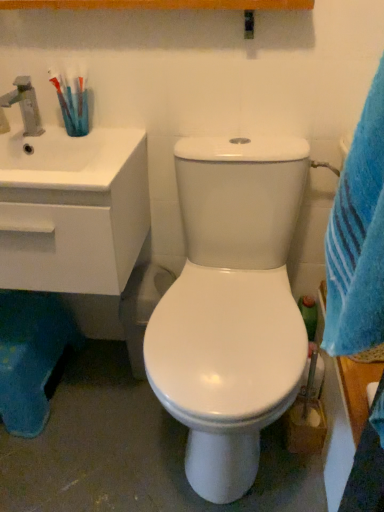
Describe the element at coordinates (30, 356) in the screenshot. I see `blue plush rug at lower left` at that location.

This screenshot has height=512, width=384. Describe the element at coordinates (25, 105) in the screenshot. I see `matte silver faucet at upper left` at that location.

This screenshot has width=384, height=512. What are the coordinates of `blue plush rug at lower left` in the screenshot? It's located at (30, 356).

Which of these two, translucent plastic toothbrush at upper left or blue plush rug at lower left, stands shorter?

translucent plastic toothbrush at upper left is shorter.

From a real-world perspective, is translucent plastic toothbrush at upper left physically located above or below blue plush rug at lower left?

In terms of real-world spatial position, translucent plastic toothbrush at upper left is above blue plush rug at lower left.

Measure the distance between translucent plastic toothbrush at upper left and blue plush rug at lower left.

translucent plastic toothbrush at upper left is 27.72 inches from blue plush rug at lower left.

Looking at this image, is translucent plastic toothbrush at upper left outside of blue plush rug at lower left?

Indeed, translucent plastic toothbrush at upper left is completely outside blue plush rug at lower left.

From a real-world perspective, who is located lower, blue plush rug at lower left or matte silver faucet at upper left?

In real-world perspective, blue plush rug at lower left is lower.

Consider the image. Which object is thinner, blue plush rug at lower left or matte silver faucet at upper left?

matte silver faucet at upper left.

Can you confirm if blue plush rug at lower left is shorter than matte silver faucet at upper left?

In fact, blue plush rug at lower left may be taller than matte silver faucet at upper left.

Is blue plush rug at lower left spatially inside matte silver faucet at upper left, or outside of it?

The correct answer is: outside.

Would you say matte silver faucet at upper left is outside blue plush rug at lower left?

Indeed, matte silver faucet at upper left is completely outside blue plush rug at lower left.

Is matte silver faucet at upper left positioned far away from blue plush rug at lower left?

No, matte silver faucet at upper left is in close proximity to blue plush rug at lower left.

Locate an element on the screen. tap located in front of the blue plush rug at lower left is located at coordinates (25, 105).

Between point (37, 110) and point (64, 321), which one is positioned in front?

Point (37, 110)

Is blue plush rug at lower left shorter than translucent plastic toothbrush at upper left?

No, blue plush rug at lower left is not shorter than translucent plastic toothbrush at upper left.

In terms of width, does blue plush rug at lower left look wider or thinner when compared to translucent plastic toothbrush at upper left?

blue plush rug at lower left is wider than translucent plastic toothbrush at upper left.

Is blue plush rug at lower left to the left or to the right of translucent plastic toothbrush at upper left in the image?

blue plush rug at lower left is to the left of translucent plastic toothbrush at upper left.

Is translucent plastic toothbrush at upper left completely or partially inside blue plush rug at lower left?

No, translucent plastic toothbrush at upper left is not a part of blue plush rug at lower left.

Who is bigger, white glossy sink at left or translucent plastic toothbrush at upper left?

white glossy sink at left is bigger.

Which object is positioned more to the right, white glossy sink at left or translucent plastic toothbrush at upper left?

translucent plastic toothbrush at upper left.

Is translucent plastic toothbrush at upper left at the back of white glossy sink at left?

No, white glossy sink at left is not facing the opposite direction of translucent plastic toothbrush at upper left.

Is point (4, 191) closer or farther from the camera than point (78, 116)?

Point (4, 191).

From the image's perspective, relative to white glossy sink at left, is translucent plastic toothbrush at upper left above or below?

Based on their image positions, translucent plastic toothbrush at upper left is located above white glossy sink at left.

Locate an element on the screen. This screenshot has height=512, width=384. counter top below the translucent plastic toothbrush at upper left (from a real-world perspective) is located at coordinates (73, 210).

Can you confirm if translucent plastic toothbrush at upper left is taller than white glossy sink at left?

No, translucent plastic toothbrush at upper left is not taller than white glossy sink at left.

Looking at this image, is translucent plastic toothbrush at upper left oriented away from white glossy sink at left?

That's not correct — translucent plastic toothbrush at upper left is not looking away from white glossy sink at left.

Which is behind, point (81, 130) or point (34, 94)?

The point (34, 94) is more distant.

Is translucent plastic toothbrush at upper left facing towards matte silver faucet at upper left?

No, translucent plastic toothbrush at upper left is not turned towards matte silver faucet at upper left.

Can you confirm if translucent plastic toothbrush at upper left is wider than matte silver faucet at upper left?

No.

Between translucent plastic toothbrush at upper left and matte silver faucet at upper left, which one has less height?

matte silver faucet at upper left is shorter.

You are a GUI agent. You are given a task and a screenshot of the screen. Output one action in this format:
    pyautogui.click(x=<x>, y=<y>)
    Task: Click on the toothbrush to the right of blue plush rug at lower left
    The image size is (384, 512).
    Given the screenshot: What is the action you would take?
    pyautogui.click(x=72, y=100)

There is a blue plush rug at lower left. At what (x,y) coordinates should I click in order to perform the action: click on tap above it (from a real-world perspective). Please return your answer as a coordinate pair (x, y). The image size is (384, 512). Looking at the image, I should click on (25, 105).

Considering their positions, is translucent plastic toothbrush at upper left positioned further to matte silver faucet at upper left than white glossy sink at left?

white glossy sink at left lies further to matte silver faucet at upper left than the other object.

From the image, which object appears to be nearer to white glossy sink at left, translucent plastic toothbrush at upper left or blue plush rug at lower left?

Among the two, translucent plastic toothbrush at upper left is located nearer to white glossy sink at left.

Looking at the image, which one is located further to white glossy sink at left, blue plush rug at lower left or translucent plastic toothbrush at upper left?

The object further to white glossy sink at left is blue plush rug at lower left.

When comparing their distances from blue plush rug at lower left, does matte silver faucet at upper left or white glossy sink at left seem further?

Among the two, matte silver faucet at upper left is located further to blue plush rug at lower left.

When comparing their distances from translucent plastic toothbrush at upper left, does white glossy sink at left or blue plush rug at lower left seem further?

Among the two, blue plush rug at lower left is located further to translucent plastic toothbrush at upper left.

When comparing their distances from translucent plastic toothbrush at upper left, does blue plush rug at lower left or white glossy sink at left seem further?

blue plush rug at lower left lies further to translucent plastic toothbrush at upper left than the other object.

Which object lies nearer to the anchor point matte silver faucet at upper left, white glossy sink at left or translucent plastic toothbrush at upper left?

translucent plastic toothbrush at upper left is closer to matte silver faucet at upper left.

Which object lies further to the anchor point matte silver faucet at upper left, white glossy sink at left or blue plush rug at lower left?

Among the two, blue plush rug at lower left is located further to matte silver faucet at upper left.

You are a GUI agent. You are given a task and a screenshot of the screen. Output one action in this format:
    pyautogui.click(x=<x>, y=<y>)
    Task: Click on the tap between translucent plastic toothbrush at upper left and white glossy sink at left in the up-down direction
    The width and height of the screenshot is (384, 512).
    Given the screenshot: What is the action you would take?
    pyautogui.click(x=25, y=105)

This screenshot has height=512, width=384. I want to click on counter top that lies between translucent plastic toothbrush at upper left and blue plush rug at lower left from top to bottom, so click(73, 210).

Image resolution: width=384 pixels, height=512 pixels. I want to click on tap between translucent plastic toothbrush at upper left and blue plush rug at lower left in the up-down direction, so click(25, 105).

What are the coordinates of `counter top between matte silver faucet at upper left and blue plush rug at lower left in the vertical direction` in the screenshot? It's located at (73, 210).